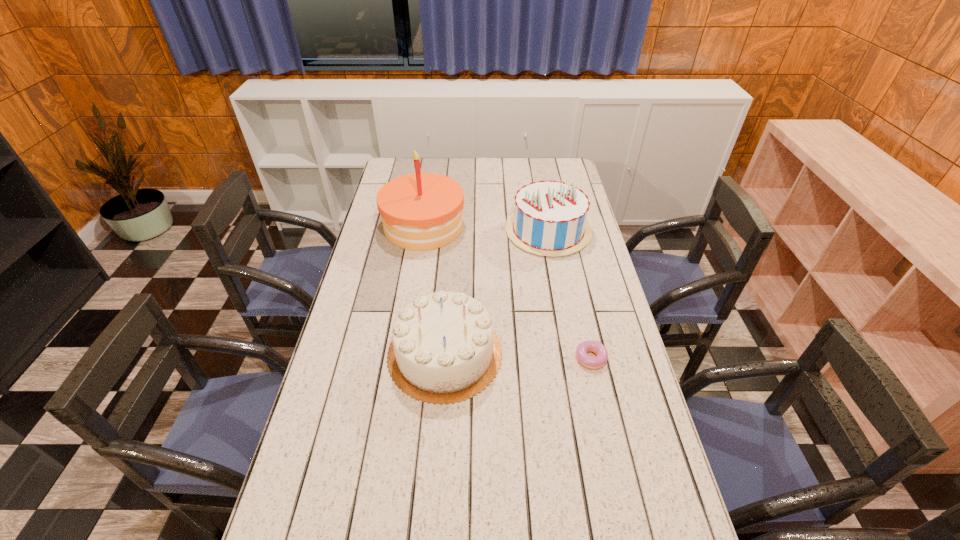
This screenshot has height=540, width=960. Identify the location of the tallest birthday cake. (422, 211).

Identify the location of the rightmost birthday cake. Image resolution: width=960 pixels, height=540 pixels. (550, 219).

This screenshot has width=960, height=540. Identify the location of the nearest birthday cake. point(444,350).

Locate an element on the screen. the shortest object is located at coordinates (600, 360).

Find the location of a particular element. The height and width of the screenshot is (540, 960). free space located 0.120m on the right of the tallest birthday cake is located at coordinates (494, 226).

Locate an element on the screen. This screenshot has height=540, width=960. free space located 0.390m on the back of the rightmost birthday cake is located at coordinates (536, 162).

At what (x,y) coordinates should I click in order to perform the action: click on vacant space positioned on the back of the nearest birthday cake. Please return your answer as a coordinate pair (x, y). Looking at the image, I should click on click(x=451, y=268).

Find the location of a particular element. The height and width of the screenshot is (540, 960). free space located 0.290m on the back of the doughnut is located at coordinates point(573,281).

At what (x,y) coordinates should I click in order to perform the action: click on object present at the left edge. Please return your answer as a coordinate pair (x, y). The height and width of the screenshot is (540, 960). Looking at the image, I should click on (422, 211).

Where is `birthday cake present at the right edge`? The width and height of the screenshot is (960, 540). birthday cake present at the right edge is located at coordinates (550, 219).